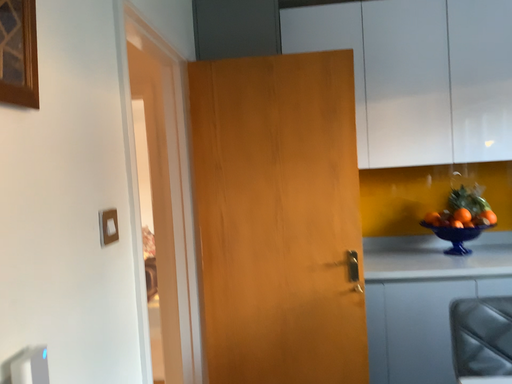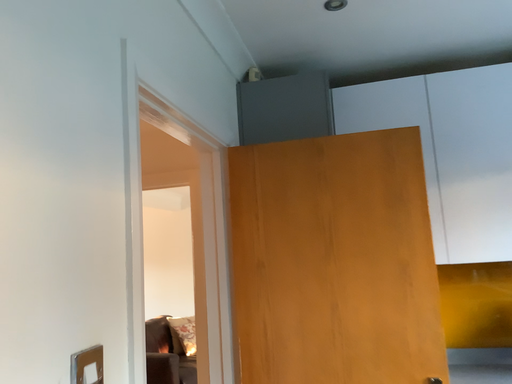
Question: Which way did the camera rotate in the video?

Choices:
 (A) rotated upward
 (B) rotated downward

Answer: (A)